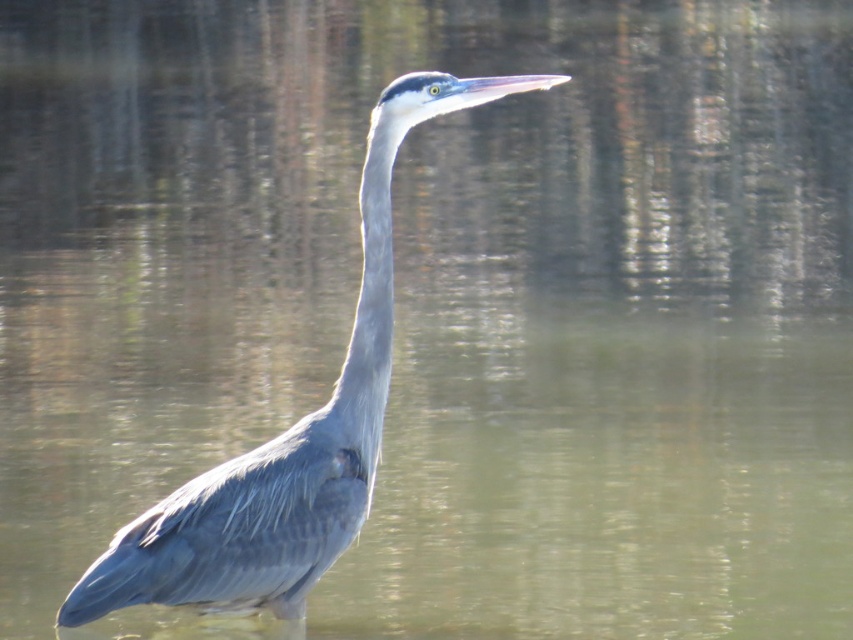
You are a photographer trying to capture the Great Blue Heron in the image. You notice two points marked in the scene. The first point is at coordinates point [415,84] and the second is at point [376,188]. Which point is closer to the heron?

Point [415,84] is closer to the heron because it is in front of point [376,188].

You are a photographer trying to capture the Great Blue Heron in the image. You notice a point at coordinates (289,435). Where exactly is this point located on the bird?

The point at coordinates (289,435) is located on the gray matte bird at center.